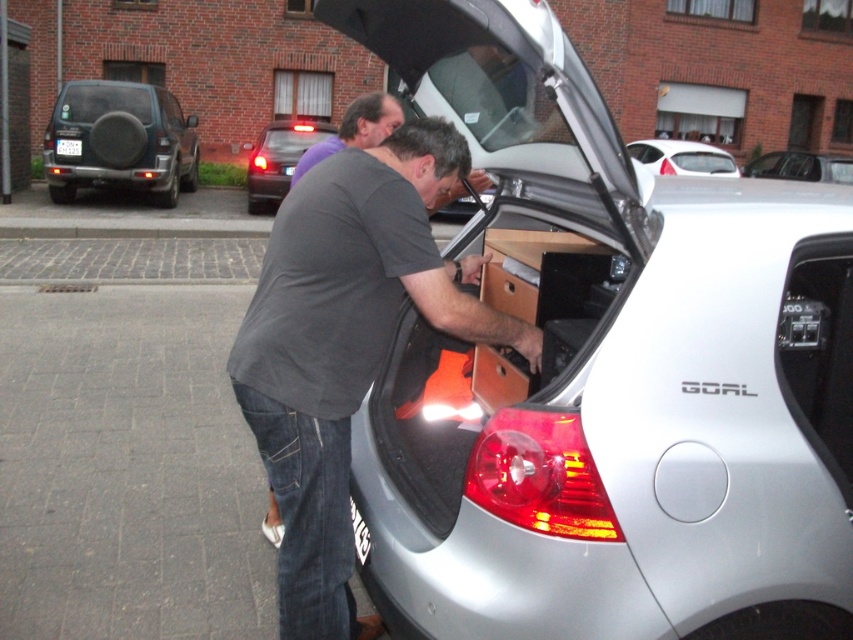
In order to click on dark gray t-shirt at center in this screenshot , I will do `click(346, 344)`.

Which is more to the left, dark gray t-shirt at center or metallic silver car at center?

dark gray t-shirt at center

Locate an element on the screen. This screenshot has height=640, width=853. dark gray t-shirt at center is located at coordinates (346, 344).

Is silver metallic car at center wider than matte black suv at left?

In fact, silver metallic car at center might be narrower than matte black suv at left.

Can you confirm if silver metallic car at center is smaller than matte black suv at left?

Yes, silver metallic car at center is smaller than matte black suv at left.

Is point (503, 358) positioned before point (80, 90)?

Yes.

Find the location of a particular element. Image resolution: width=853 pixels, height=640 pixels. silver metallic car at center is located at coordinates (605, 374).

Can you confirm if dark gray t-shirt at center is bigger than dark gray shirt at center?

Actually, dark gray t-shirt at center might be smaller than dark gray shirt at center.

Who is more distant from viewer, (250, 339) or (312, 145)?

Positioned behind is point (312, 145).

The height and width of the screenshot is (640, 853). I want to click on dark gray t-shirt at center, so click(346, 344).